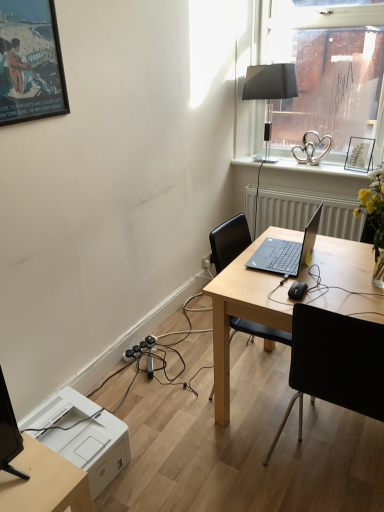
In order to click on unoccupied region to the right of sleek black laptop at center in this screenshot , I will do `click(339, 254)`.